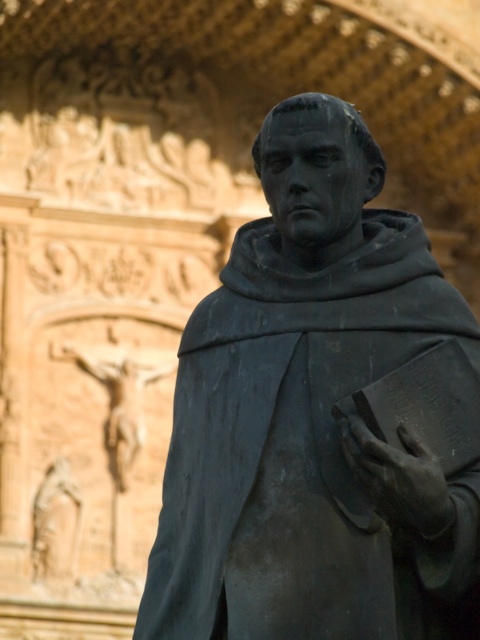
Question: Is bronze statue at center to the right of matte black hand at lower right from the viewer's perspective?

Choices:
 (A) no
 (B) yes

Answer: (A)

Question: Among these points, which one is nearest to the camera?

Choices:
 (A) (419, 337)
 (B) (418, 506)

Answer: (B)

Question: Is bronze statue at center closer to the viewer compared to matte black hand at lower right?

Choices:
 (A) no
 (B) yes

Answer: (A)

Question: Does bronze statue at center appear over matte black hand at lower right?

Choices:
 (A) yes
 (B) no

Answer: (A)